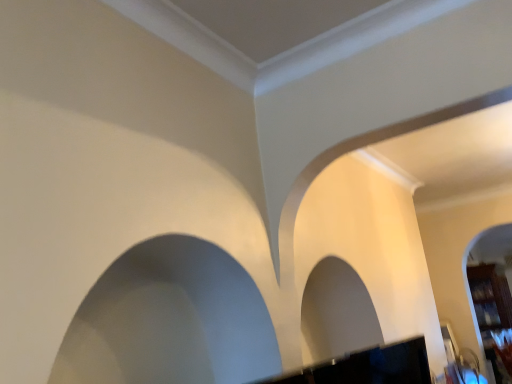
Question: Does wooden bookshelf at right appear on the left side of white smooth rock arch at left?

Choices:
 (A) no
 (B) yes

Answer: (A)

Question: Is wooden bookshelf at right looking in the opposite direction of white smooth rock arch at left?

Choices:
 (A) no
 (B) yes

Answer: (A)

Question: Is wooden bookshelf at right positioned beyond the bounds of white smooth rock arch at left?

Choices:
 (A) yes
 (B) no

Answer: (A)

Question: Can you confirm if wooden bookshelf at right is wider than white smooth rock arch at left?

Choices:
 (A) yes
 (B) no

Answer: (A)

Question: Is wooden bookshelf at right behind white smooth rock arch at left?

Choices:
 (A) no
 (B) yes

Answer: (B)

Question: From the image's perspective, would you say wooden bookshelf at right is positioned over white smooth rock arch at left?

Choices:
 (A) yes
 (B) no

Answer: (B)

Question: Is white smooth rock arch at left far from wooden bookshelf at right?

Choices:
 (A) yes
 (B) no

Answer: (A)

Question: Can you confirm if white smooth rock arch at left is bigger than wooden bookshelf at right?

Choices:
 (A) no
 (B) yes

Answer: (A)

Question: Is white smooth rock arch at left behind wooden bookshelf at right?

Choices:
 (A) yes
 (B) no

Answer: (B)

Question: Can you confirm if white smooth rock arch at left is smaller than wooden bookshelf at right?

Choices:
 (A) yes
 (B) no

Answer: (A)

Question: Does white smooth rock arch at left have a lesser width compared to wooden bookshelf at right?

Choices:
 (A) yes
 (B) no

Answer: (A)

Question: From the image's perspective, is white smooth rock arch at left below wooden bookshelf at right?

Choices:
 (A) no
 (B) yes

Answer: (A)

Question: In terms of height, does white smooth rock arch at left look taller or shorter compared to wooden bookshelf at right?

Choices:
 (A) tall
 (B) short

Answer: (B)